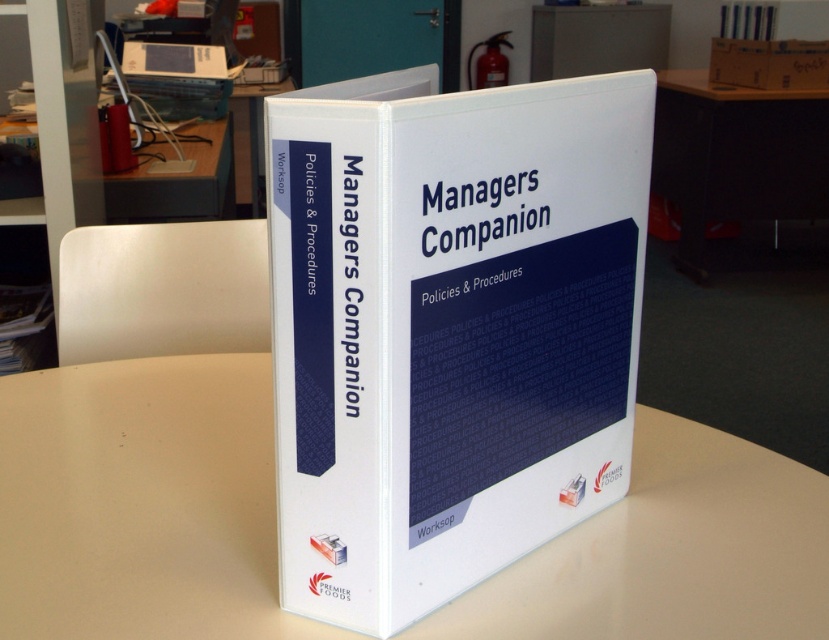
You are a student who needs to place a heavy textbook on a surface. Which object between the black plastic table at lower right and the white plastic bookshelf at lower left would be more suitable for placing the textbook?

The black plastic table at lower right has a greater height compared to the white plastic bookshelf at lower left. Therefore, the black plastic table at lower right would be more suitable for placing the textbook as it provides a higher surface which is easier to access.

You are organizing a storage area and need to stack items vertically. You have a brown cardboard box at upper right and a white matte book at upper center. Which item should you place at the bottom to ensure stability?

The brown cardboard box at upper right is taller than the white matte book at upper center, so you should place the brown cardboard box at upper right at the bottom to ensure stability since taller items are typically placed lower for stability.